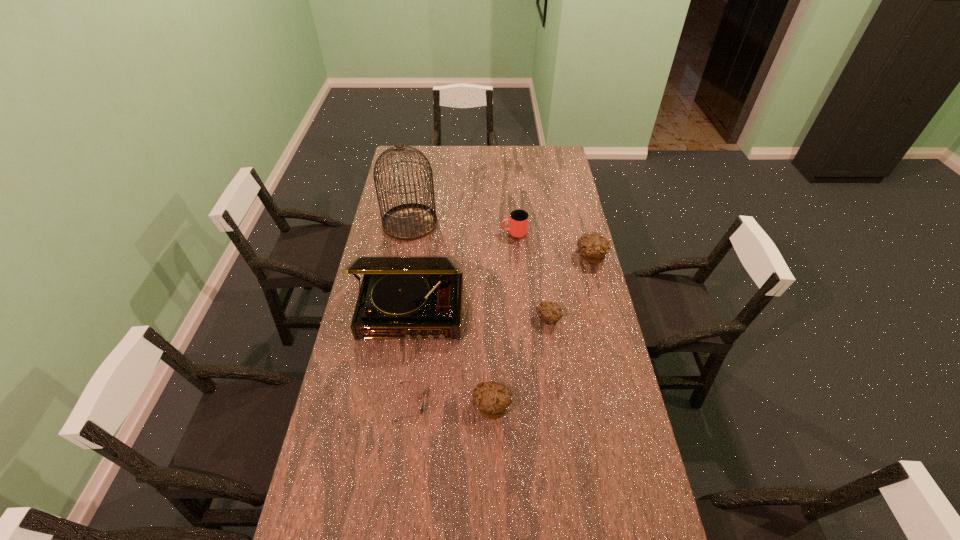
This screenshot has width=960, height=540. I want to click on vacant space that satisfies the following two spatial constraints: 1. on the front side of the fifth nearest object; 2. on the lenses of the shortest object, so click(627, 403).

Locate an element on the screen. The image size is (960, 540). vacant region that satisfies the following two spatial constraints: 1. on the front side of the rightmost muffin; 2. on the lenses of the sunglasses is located at coordinates click(627, 403).

The height and width of the screenshot is (540, 960). I want to click on free space in the image that satisfies the following two spatial constraints: 1. on the front side of the third farthest object; 2. on the right side of the birdcage, so click(404, 256).